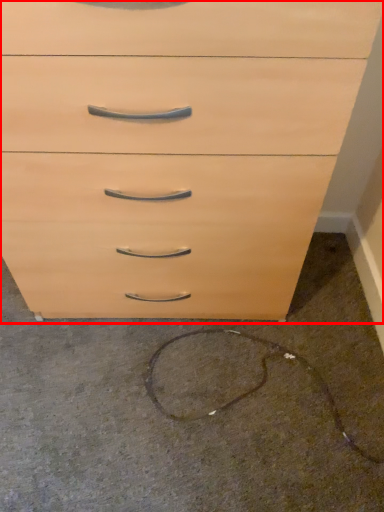
Question: From the image, what is the correct spatial relationship of chest of drawers (annotated by the red box) in relation to concrete?

Choices:
 (A) right
 (B) left

Answer: (B)